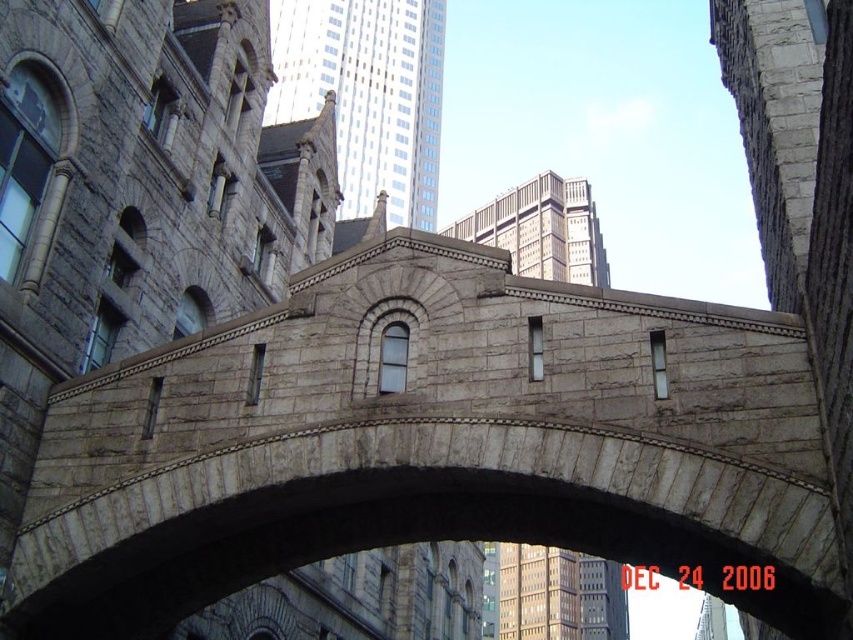
You are standing at the base of the stone bridge and want to determine which of the two points, point (381, 10) or point (511, 250), is nearer to you. Based on the bridge structure, which point is closer?

Point (381, 10) is closer to the viewer than point (511, 250).

You are standing at the point marked as point (x=367, y=93) in the image. What object is located exactly at this point?

The smooth gray stone tower at upper center is located exactly at point (x=367, y=93).